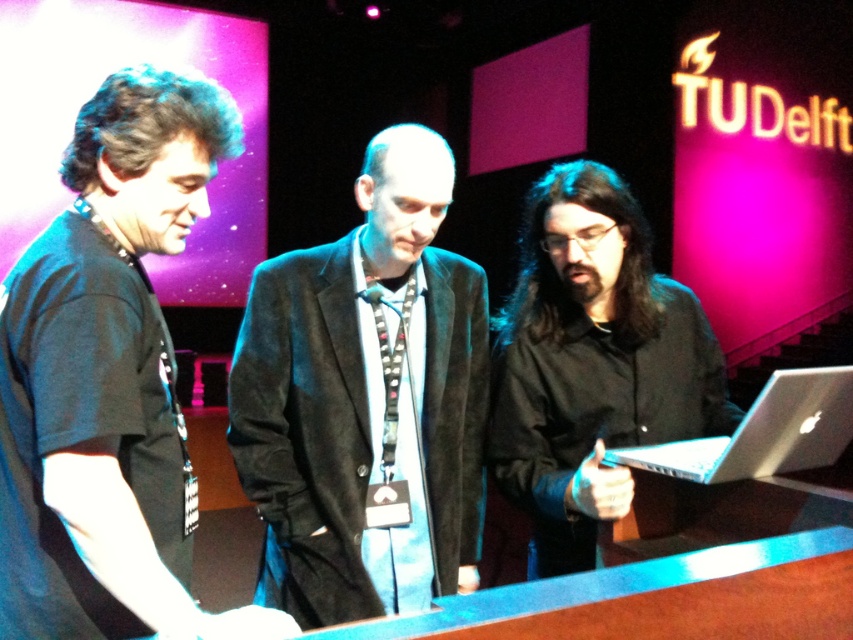
You are an event organizer at TU Delft and need to decide whether to place a 1.5 meter tall banner behind the black matte shirt at center and the silver metallic laptop at center. Based on their heights, will the banner be visible over both objects?

The black matte shirt at center is much taller than the silver metallic laptop at center. Since the banner is 1.5 meters tall, it will be visible over both objects as it exceeds the height of the taller object, which is the black matte shirt at center.

You are an attendee at the TU Delft event and want to take a photo of the silver metallic laptop at center. However, the black matte shirt at left is blocking your view. Can you move around to the right side of the scene to get an unobstructed view?

The black matte shirt at left is closer to the viewer than the silver metallic laptop at center, so moving to the right side of the scene may allow you to see around the obstruction caused by the black matte shirt at left and get a clear view of the silver metallic laptop at center.